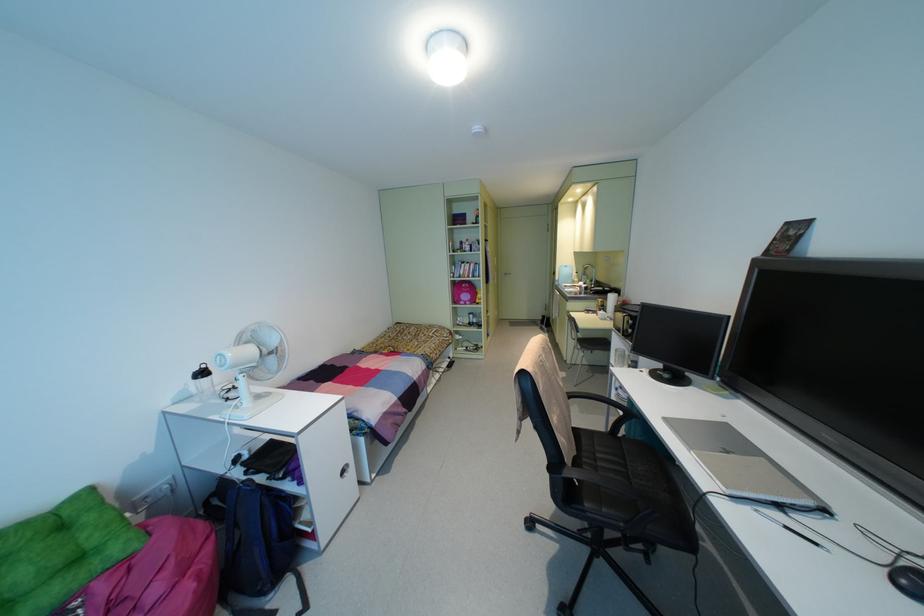
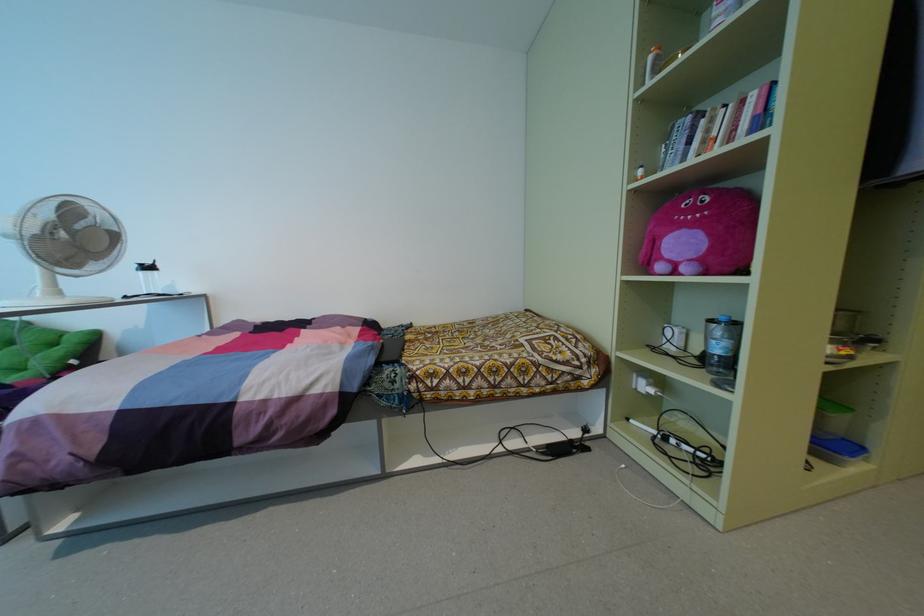
Where in the second image is the point corresponding to pixel 468 270 from the first image?

(734, 129)